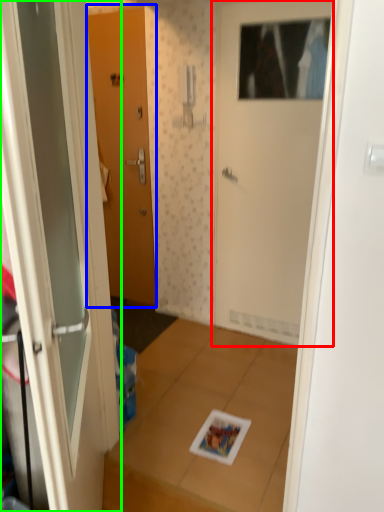
Question: Which object is the closest to the door (highlighted by a red box)? Choose among these: door (highlighted by a blue box) or door (highlighted by a green box).

Choices:
 (A) door
 (B) door

Answer: (A)